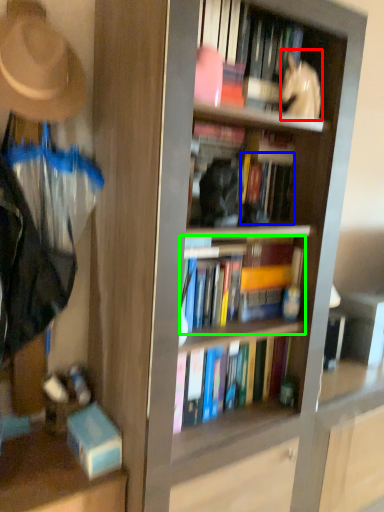
Question: Which object is positioned farthest from person (highlighted by a red box)? Select from book (highlighted by a blue box) and book (highlighted by a green box).

Choices:
 (A) book
 (B) book

Answer: (B)